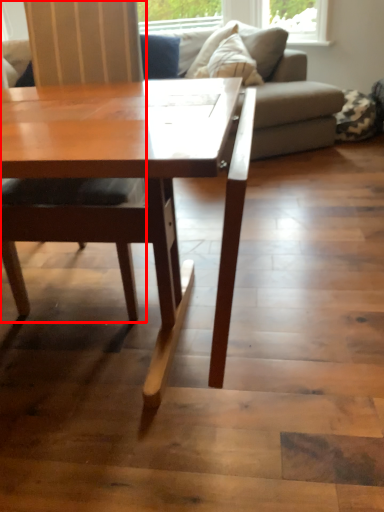
Question: From the image's perspective, what is the correct spatial positioning of chair (annotated by the red box) in reference to studio couch?

Choices:
 (A) below
 (B) above

Answer: (A)